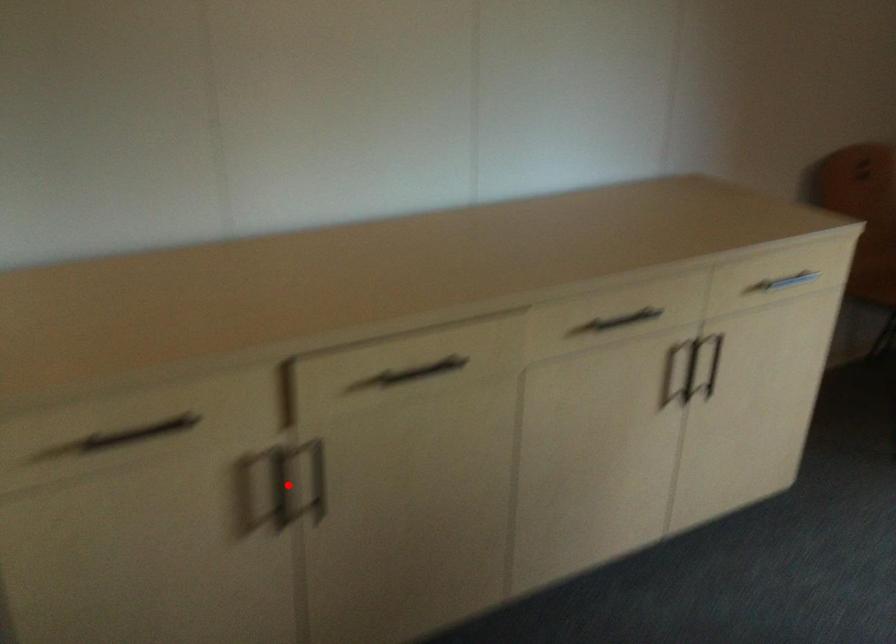
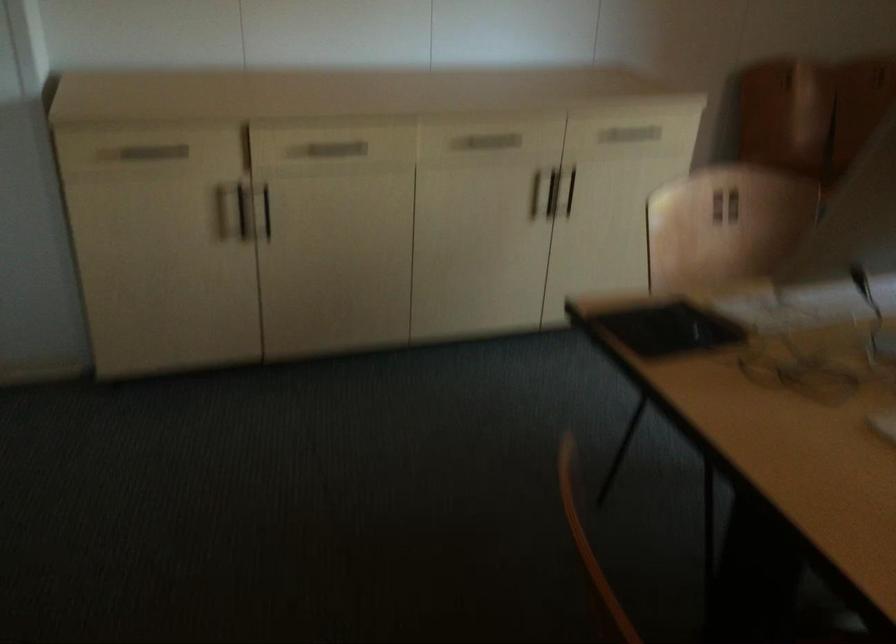
Find the pixel in the second image that matches the highlighted location in the first image.

(243, 211)